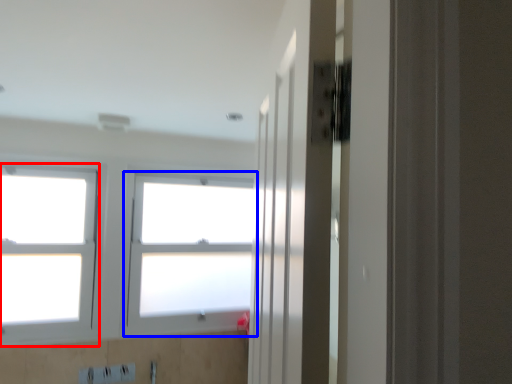
Question: Among these objects, which one is farthest to the camera, window (highlighted by a red box) or window (highlighted by a blue box)?

Choices:
 (A) window
 (B) window

Answer: (B)